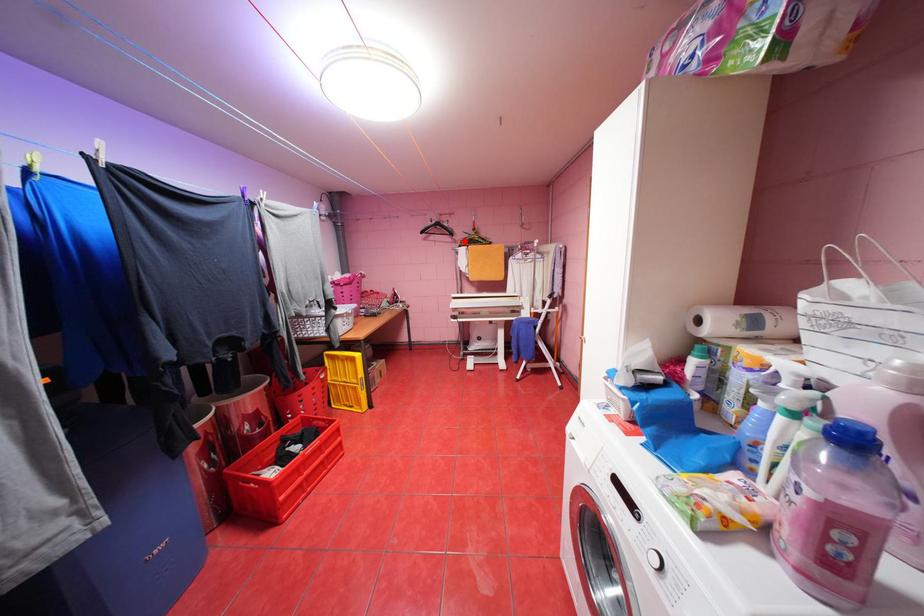
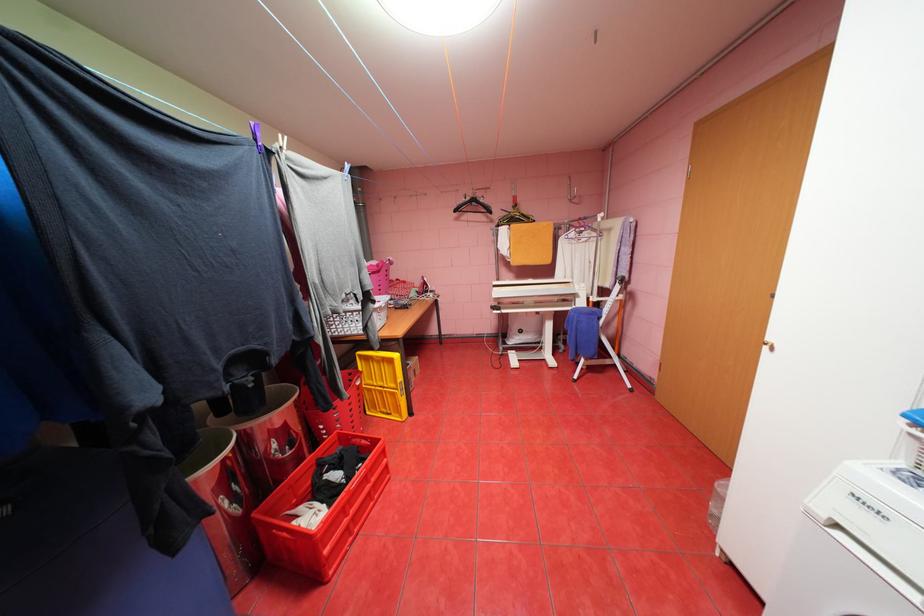
In the second image, find the point that corresponds to the highlighted location in the first image.

(500, 221)